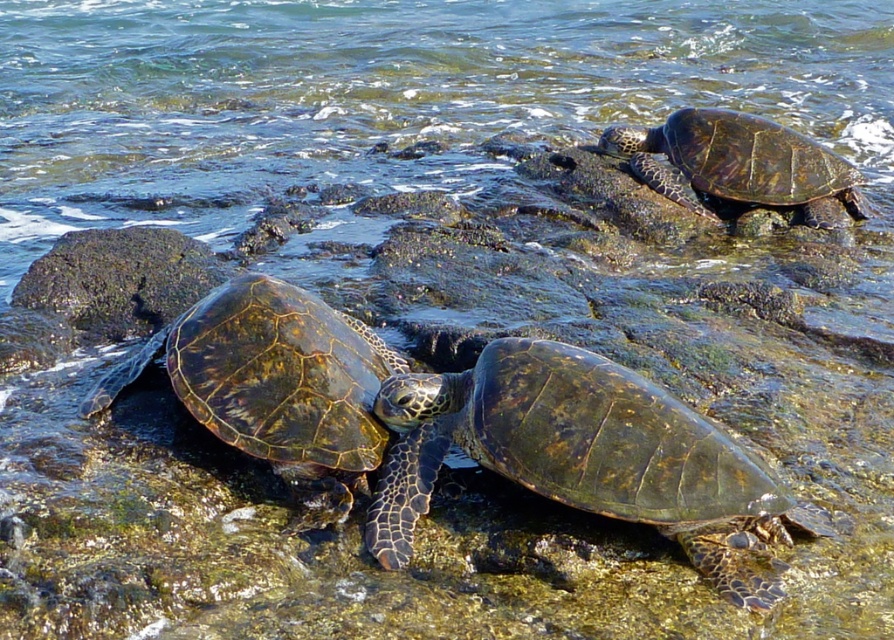
Question: Among these points, which one is farthest from the camera?

Choices:
 (A) (65, 305)
 (B) (605, 387)
 (C) (385, 556)
 (D) (724, 150)

Answer: (D)

Question: Which object is closer to the camera taking this photo?

Choices:
 (A) green mossy rock at left
 (B) leathery green turtle at center
 (C) leathery greenish-brown turtle at upper right
 (D) shiny dark green tortoise at center

Answer: (D)

Question: Does shiny dark green tortoise at center have a smaller size compared to leathery green turtle at center?

Choices:
 (A) no
 (B) yes

Answer: (B)

Question: In this image, where is leathery green turtle at center located relative to leathery greenish-brown turtle at upper right?

Choices:
 (A) above
 (B) below

Answer: (B)

Question: Is shiny dark green tortoise at center to the right of leathery greenish-brown turtle at upper right from the viewer's perspective?

Choices:
 (A) no
 (B) yes

Answer: (A)

Question: Estimate the real-world distances between objects in this image. Which object is closer to the green mossy rock at left?

Choices:
 (A) leathery green turtle at center
 (B) leathery greenish-brown turtle at upper right

Answer: (A)